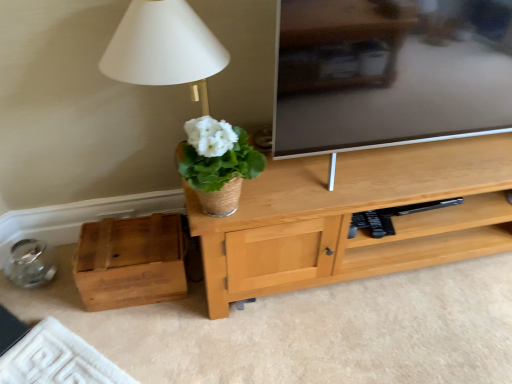
Find the location of `empty space that is ontop of wooden box at lower left (from a real-world perspective)`. empty space that is ontop of wooden box at lower left (from a real-world perspective) is located at coordinates (135, 239).